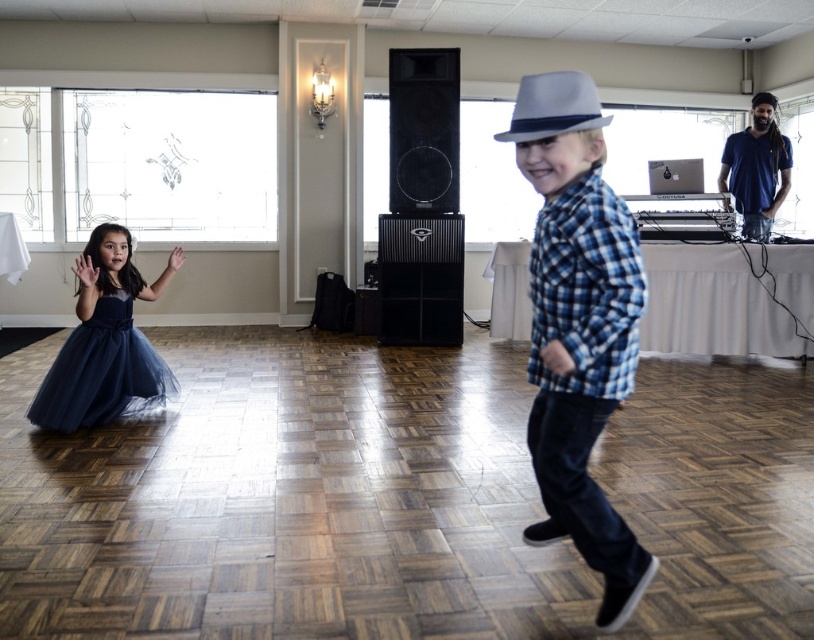
You are standing in the room and want to walk from point (x=112, y=365) to point (x=530, y=104). Which direction should you face to move towards the latter?

You should face towards the upper left direction because point (x=530, y=104) is located in that direction relative to point (x=112, y=365).

You are standing at the point marked as point (615, 548) in the image. The camera is positioned such that it can capture the entire room. If you want to take a photo of the stained glass windows on the wall behind you, will you be able to do so without moving from your current position?

Since the distance of point (615, 548) from the camera is 5.44 feet, you are positioned within the camera frame. However, the stained glass windows are on the wall behind you, so you would need to turn around to capture them in the photo. Therefore, you can take the photo without moving your feet, but you will need to reorient yourself to face the windows.